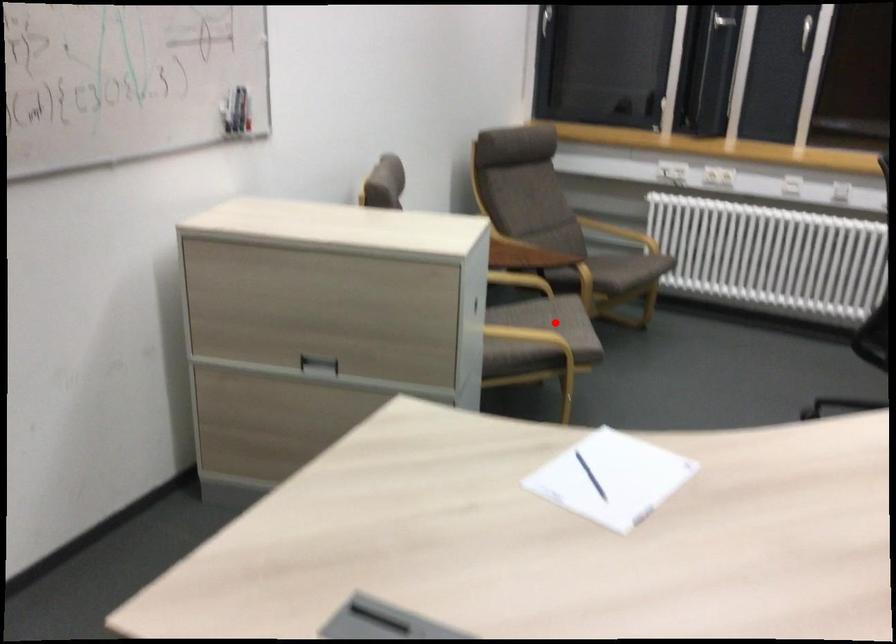
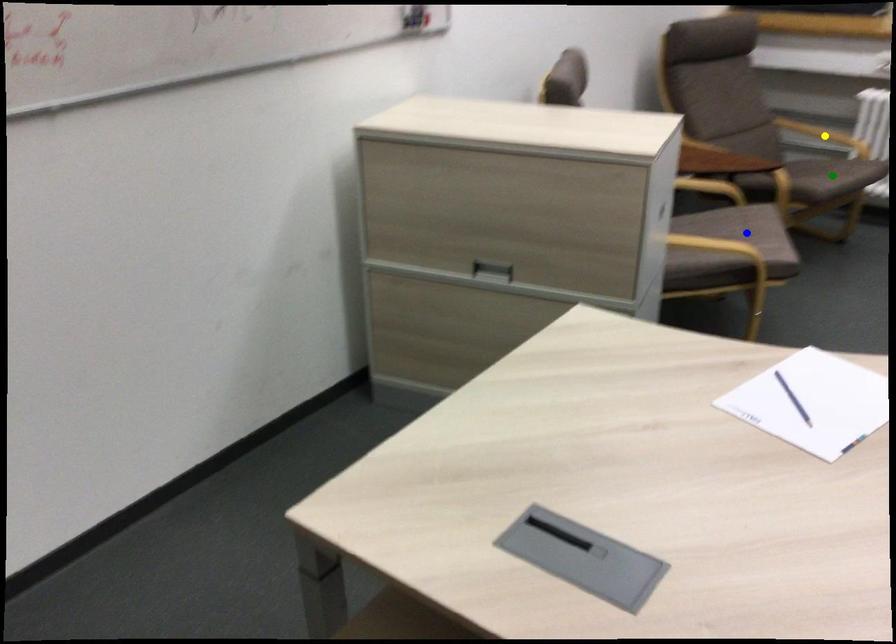
Question: I am providing you with two images of the same scene from different viewpoints. A red point is marked on the first image. You are given multiple points on the second image. In image 2, which mark is for the same physical point as the one in image 1?

Choices:
 (A) green point
 (B) blue point
 (C) yellow point

Answer: (B)